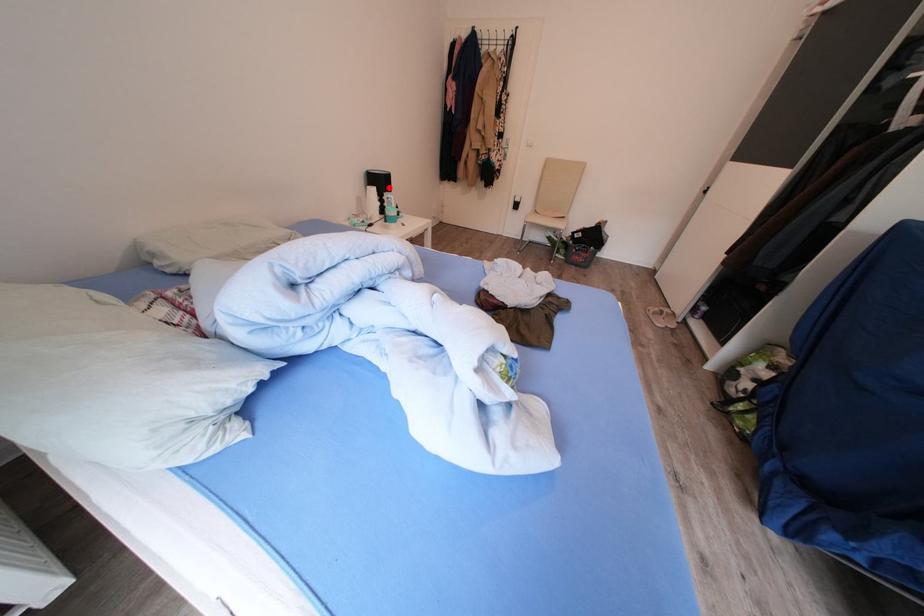
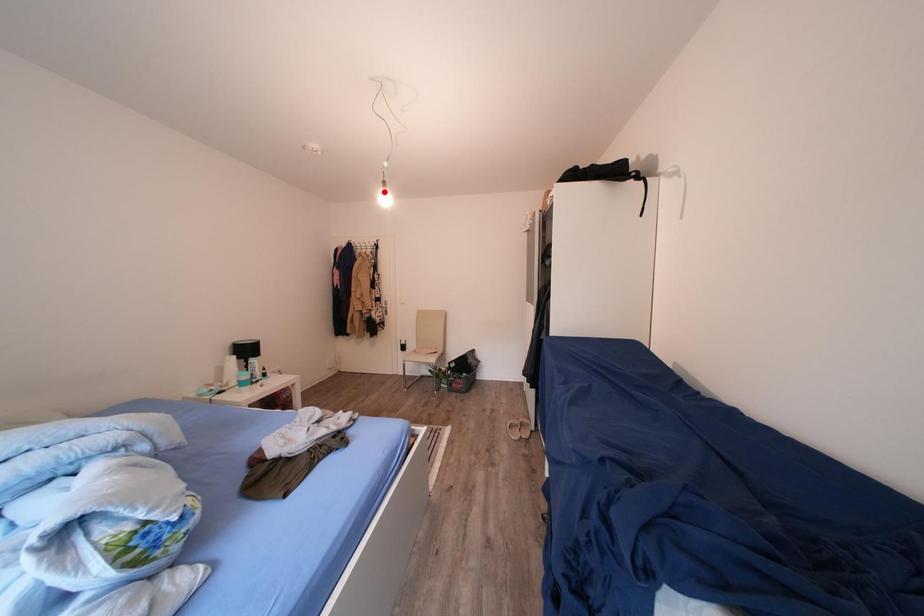
I am providing you with two images of the same scene from different viewpoints. A red point is marked on the first image and another point is marked on the second image. Are the points marked in image1 and image2 representing the same 3D position?

No